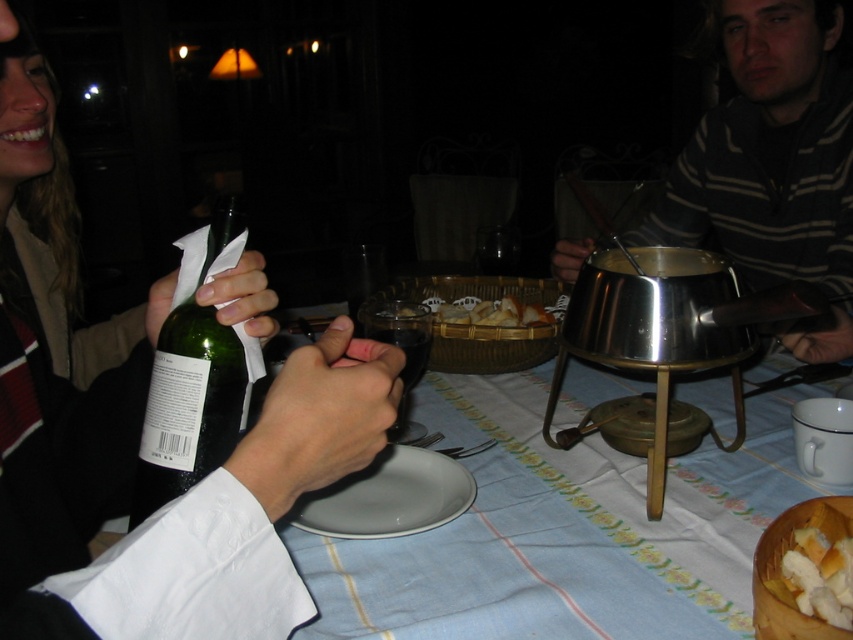
Question: Considering the real-world distances, which object is closest to the white glossy plate at center?

Choices:
 (A) white bread at lower right
 (B) green glass bottle at left
 (C) golden brown bread at center

Answer: (B)

Question: Is white glossy plate at center wider than golden brown bread at center?

Choices:
 (A) yes
 (B) no

Answer: (B)

Question: Which of these objects is positioned closest to the transparent glass at center?

Choices:
 (A) striped sweater at right
 (B) matte green bottle at lower left

Answer: (B)

Question: Is matte green bottle at lower left below golden brown bread at center?

Choices:
 (A) no
 (B) yes

Answer: (A)

Question: Which of the following is the closest to the observer?

Choices:
 (A) white glossy plate at center
 (B) green glass bottle at left
 (C) white bread at lower right
 (D) transparent glass at center

Answer: (C)

Question: Is transparent glass at center to the left of golden brown bread at center from the viewer's perspective?

Choices:
 (A) yes
 (B) no

Answer: (A)